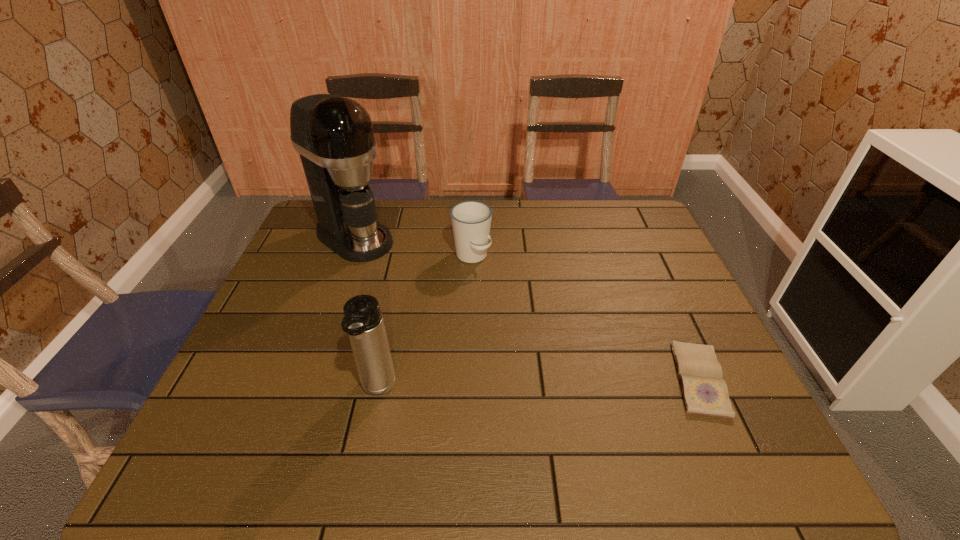
Find the location of a particular element. vacant space on the desktop that is between the second tallest object and the diary and is positioned with a handle on the side of the cup is located at coordinates (579, 383).

Locate an element on the screen. free space on the desktop that is between the thermos bottle and the diary and is positioned place cup under the spout of the coffee maker is located at coordinates (562, 384).